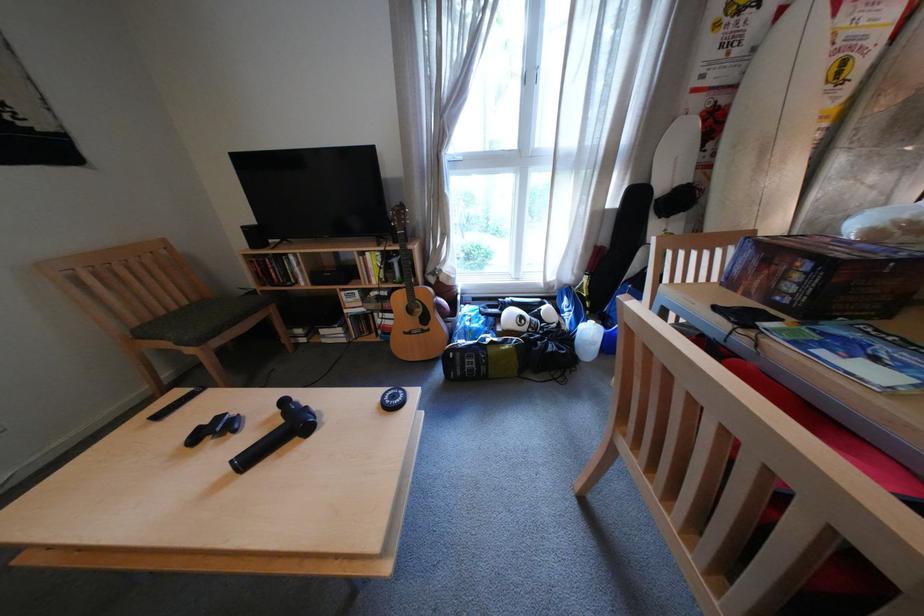
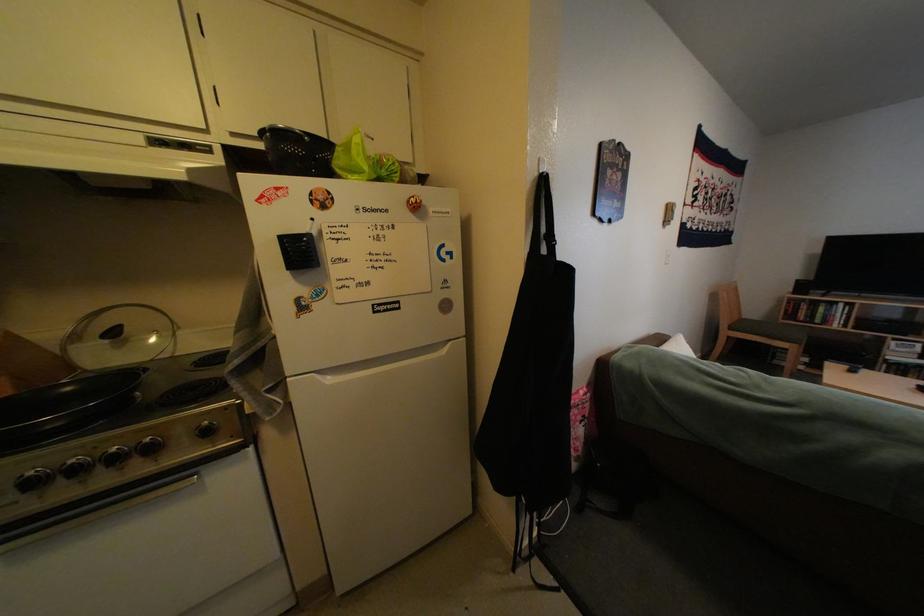
Where in the second image is the point corresponding to point 271,238 from the first image?

(816, 288)